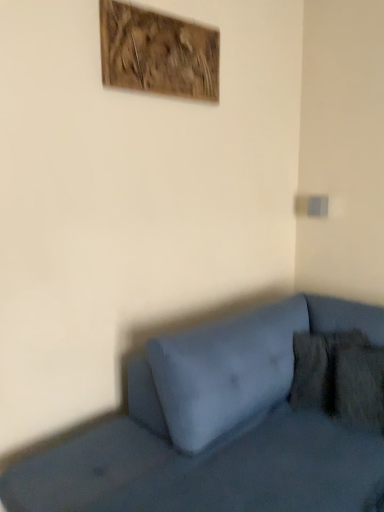
Question: Is velvety brown pillow at lower right at the left side of matte blue couch at lower right?

Choices:
 (A) no
 (B) yes

Answer: (A)

Question: Does velvety brown pillow at lower right have a lesser height compared to matte blue couch at lower right?

Choices:
 (A) yes
 (B) no

Answer: (A)

Question: Is the depth of velvety brown pillow at lower right less than that of matte blue couch at lower right?

Choices:
 (A) no
 (B) yes

Answer: (A)

Question: Is velvety brown pillow at lower right located outside matte blue couch at lower right?

Choices:
 (A) yes
 (B) no

Answer: (B)

Question: Can you confirm if velvety brown pillow at lower right is wider than matte blue couch at lower right?

Choices:
 (A) yes
 (B) no

Answer: (B)

Question: Is wooden textured artwork at upper center wider or thinner than velvety brown pillow at lower right?

Choices:
 (A) wide
 (B) thin

Answer: (B)

Question: From a real-world perspective, relative to velvety brown pillow at lower right, is wooden textured artwork at upper center vertically above or below?

Choices:
 (A) above
 (B) below

Answer: (A)

Question: In terms of size, does wooden textured artwork at upper center appear bigger or smaller than velvety brown pillow at lower right?

Choices:
 (A) small
 (B) big

Answer: (A)

Question: Would you say wooden textured artwork at upper center is to the left or to the right of velvety brown pillow at lower right in the picture?

Choices:
 (A) left
 (B) right

Answer: (A)

Question: In terms of size, does matte blue couch at lower right appear bigger or smaller than wooden textured artwork at upper center?

Choices:
 (A) small
 (B) big

Answer: (B)

Question: Is point (379, 442) positioned closer to the camera than point (180, 62)?

Choices:
 (A) closer
 (B) farther

Answer: (A)

Question: In terms of height, does matte blue couch at lower right look taller or shorter compared to wooden textured artwork at upper center?

Choices:
 (A) short
 (B) tall

Answer: (B)

Question: From the image's perspective, is matte blue couch at lower right positioned above or below wooden textured artwork at upper center?

Choices:
 (A) below
 (B) above

Answer: (A)

Question: From a real-world perspective, is matte blue couch at lower right positioned above or below velvety brown pillow at lower right?

Choices:
 (A) below
 (B) above

Answer: (A)

Question: Looking at the image, does matte blue couch at lower right seem bigger or smaller compared to velvety brown pillow at lower right?

Choices:
 (A) big
 (B) small

Answer: (A)